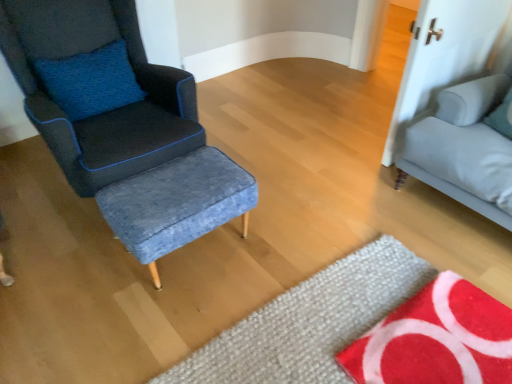
The width and height of the screenshot is (512, 384). What are the coordinates of `vacant area that lies between denim fabric stool at center and textured wool mat at lower center, positioned as the 2th mat in right-to-left order` in the screenshot? It's located at (247, 277).